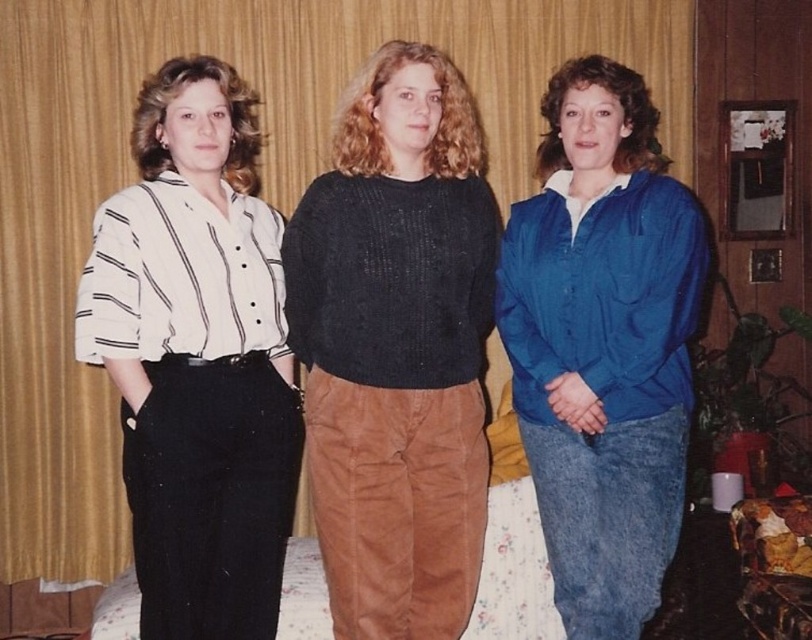
Can you confirm if white striped shirt at left is positioned to the right of floral fabric bed at center?

In fact, white striped shirt at left is to the left of floral fabric bed at center.

Who is taller, white striped shirt at left or floral fabric bed at center?

Standing taller between the two is white striped shirt at left.

Who is more distant from viewer, (214, 502) or (558, 624)?

The point (558, 624) is more distant.

Image resolution: width=812 pixels, height=640 pixels. Identify the location of white striped shirt at left. (197, 356).

This screenshot has width=812, height=640. What do you see at coordinates (603, 344) in the screenshot?
I see `blue denim jacket at center` at bounding box center [603, 344].

Consider the image. Between blue denim jacket at center and floral fabric bed at center, which one is positioned higher?

blue denim jacket at center is above.

Describe the element at coordinates (603, 344) in the screenshot. This screenshot has width=812, height=640. I see `blue denim jacket at center` at that location.

You are a GUI agent. You are given a task and a screenshot of the screen. Output one action in this format:
    pyautogui.click(x=<x>, y=<y>)
    Task: Click on the blue denim jacket at center
    This screenshot has height=640, width=812.
    Given the screenshot: What is the action you would take?
    pyautogui.click(x=603, y=344)

Between black knitted sweater at center and blue denim jacket at center, which one appears on the right side from the viewer's perspective?

Positioned to the right is blue denim jacket at center.

Image resolution: width=812 pixels, height=640 pixels. Find the location of `black knitted sweater at center`. black knitted sweater at center is located at coordinates (396, 348).

The height and width of the screenshot is (640, 812). What are the coordinates of `black knitted sweater at center` in the screenshot? It's located at (396, 348).